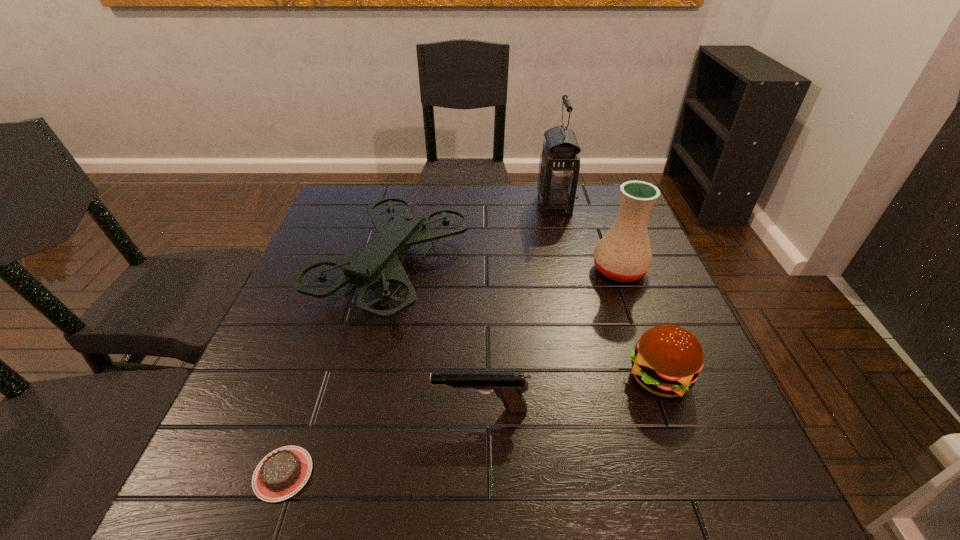
Identify the location of vacant space at the right edge. The image size is (960, 540). (626, 292).

I want to click on vacant region at the near left corner of the desktop, so click(267, 519).

This screenshot has width=960, height=540. I want to click on free space between the nearest object and the drone, so click(338, 371).

Locate an element on the screen. The width and height of the screenshot is (960, 540). free space between the drone and the farthest object is located at coordinates (473, 237).

Locate an element on the screen. The width and height of the screenshot is (960, 540). vacant area that lies between the pottery and the lantern is located at coordinates (587, 237).

Identify the location of vacant area between the tallest object and the pottery. This screenshot has height=540, width=960. (587, 237).

Where is `blank region between the hamburger and the farthest object`? Image resolution: width=960 pixels, height=540 pixels. blank region between the hamburger and the farthest object is located at coordinates (607, 291).

You are a GUI agent. You are given a task and a screenshot of the screen. Output one action in this format:
    pyautogui.click(x=<x>, y=<y>)
    Task: Click on the empty space that is in between the pistol and the drone
    The width and height of the screenshot is (960, 540).
    Given the screenshot: What is the action you would take?
    pyautogui.click(x=437, y=339)

Where is `empty space that is in between the hamburger and the pistol`? empty space that is in between the hamburger and the pistol is located at coordinates (569, 394).

Identify the location of free area in between the hamburger and the pottery. (639, 323).